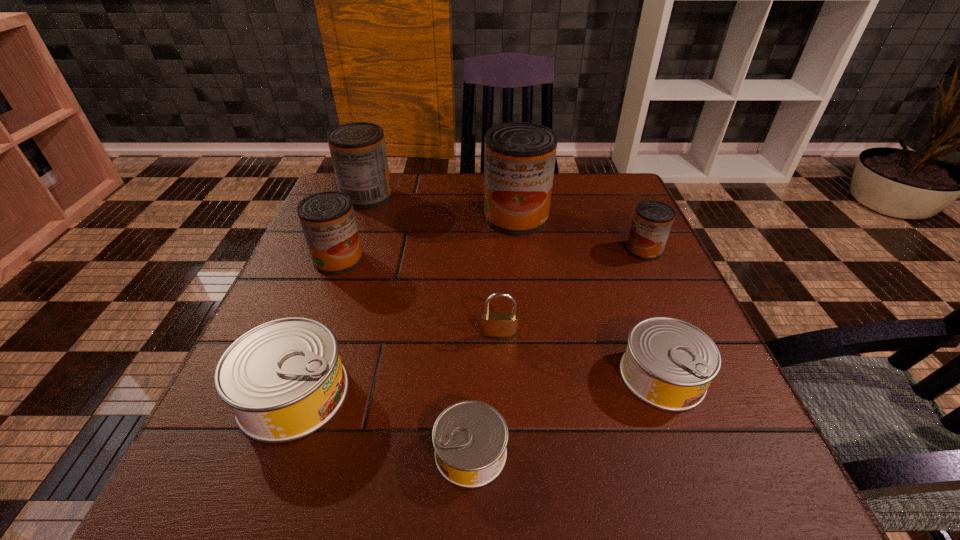
The image size is (960, 540). What are the coordinates of `free space between the brass padlock and the third smallest red can` in the screenshot? It's located at click(x=433, y=266).

This screenshot has width=960, height=540. Find the location of `vacant point located between the tallest can and the smallest red can`. vacant point located between the tallest can and the smallest red can is located at coordinates (580, 233).

The width and height of the screenshot is (960, 540). I want to click on free space between the biggest silver can and the padlock, so click(x=396, y=365).

Where is `vacant space in between the shortest object and the rightmost red can`? vacant space in between the shortest object and the rightmost red can is located at coordinates (558, 351).

Locate an element on the screen. empty space between the tallest object and the second shortest can is located at coordinates (589, 296).

Locate an element on the screen. vacant space that's between the second red can from right to left and the sixth shortest can is located at coordinates (442, 207).

Locate an element on the screen. This screenshot has height=540, width=960. empty space between the second shortest can and the smallest red can is located at coordinates (653, 313).

The height and width of the screenshot is (540, 960). What are the coordinates of `free space between the fourth nearest object and the biggest silver can` in the screenshot? It's located at (396, 365).

Point out which object is positioned as the nearest to the third biggest red can. Please provide its 2D coordinates. Your answer should be formatted as a tuple, i.e. [(x, y)], where the tuple contains the x and y coordinates of a point satisfying the conditions above.

[(358, 151)]

Image resolution: width=960 pixels, height=540 pixels. Identify the location of object that can be found as the closest to the third smallest red can. 328,222.